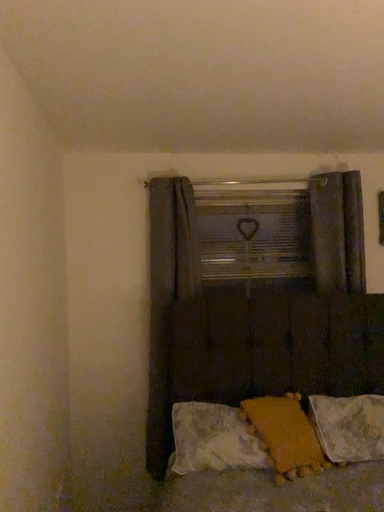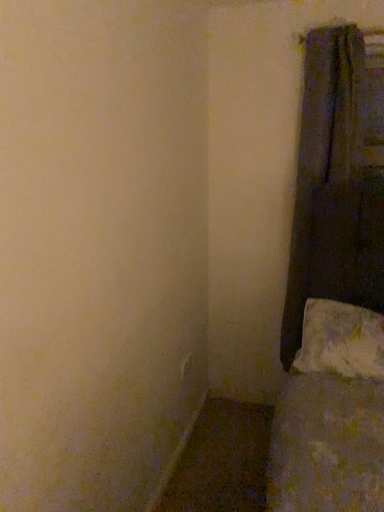
Question: How did the camera likely rotate when shooting the video?

Choices:
 (A) rotated left
 (B) rotated right

Answer: (A)